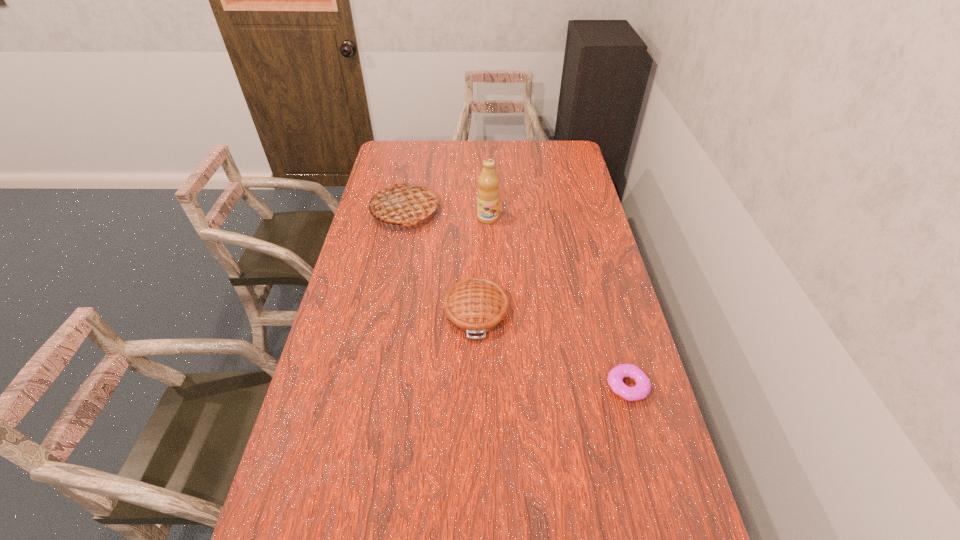
Locate an element on the screen. Image resolution: width=960 pixels, height=540 pixels. vacant point that satisfies the following two spatial constraints: 1. on the front side of the shorter pie; 2. on the right side of the doughnut is located at coordinates (476, 386).

At what (x,y) coordinates should I click in order to perform the action: click on blank area in the image that satisfies the following two spatial constraints: 1. on the label of the olive oil; 2. on the right side of the nearest object. Please return your answer as a coordinate pair (x, y). The width and height of the screenshot is (960, 540). Looking at the image, I should click on (492, 386).

You are a GUI agent. You are given a task and a screenshot of the screen. Output one action in this format:
    pyautogui.click(x=<x>, y=<y>)
    Task: Click on the vacant space that satisfies the following two spatial constraints: 1. on the label of the nearest object; 2. on the right side of the tallest object
    
    Given the screenshot: What is the action you would take?
    pyautogui.click(x=492, y=386)

Identify the location of vacant area in the image that satisfies the following two spatial constraints: 1. on the label of the olive oil; 2. on the right side of the shortest object. The width and height of the screenshot is (960, 540). (492, 386).

Identify the location of free point that satisfies the following two spatial constraints: 1. on the label of the shortest object; 2. on the right side of the tallest object. The image size is (960, 540). (492, 386).

This screenshot has width=960, height=540. I want to click on free spot that satisfies the following two spatial constraints: 1. on the label of the nearest object; 2. on the right side of the olive oil, so click(x=492, y=386).